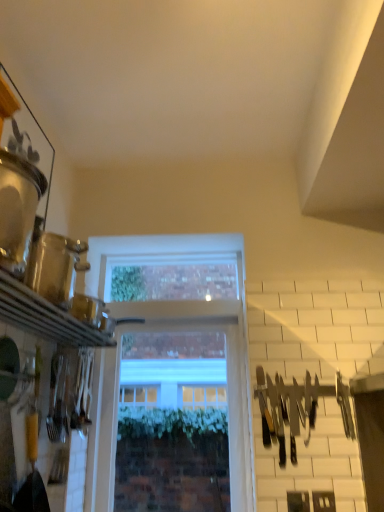
You are a GUI agent. You are given a task and a screenshot of the screen. Output one action in this format:
    pyautogui.click(x=<x>, y=<y>)
    Task: Click on the black plastic knives at right
    The width and height of the screenshot is (384, 512).
    Given the screenshot: What is the action you would take?
    pyautogui.click(x=296, y=408)

This screenshot has height=512, width=384. Describe the element at coordinates (296, 408) in the screenshot. I see `black plastic knives at right` at that location.

Where is `clear glass window at center`? clear glass window at center is located at coordinates (172, 424).

The height and width of the screenshot is (512, 384). What do you see at coordinates (172, 424) in the screenshot?
I see `clear glass window at center` at bounding box center [172, 424].

Where is `black plastic knives at right`? The height and width of the screenshot is (512, 384). black plastic knives at right is located at coordinates (296, 408).

Can you confirm if clear glass window at center is positioned to the right of black plastic knives at right?

No.

Which object is further away from the camera taking this photo, clear glass window at center or black plastic knives at right?

clear glass window at center is further away from the camera.

Does point (127, 367) lie behind point (303, 425)?

Yes.

From the image's perspective, is clear glass window at center beneath black plastic knives at right?

Yes, from the image's perspective, clear glass window at center is beneath black plastic knives at right.

From a real-world perspective, who is located higher, clear glass window at center or black plastic knives at right?

In real-world perspective, clear glass window at center is above.

Considering the sizes of objects clear glass window at center and black plastic knives at right in the image provided, who is wider, clear glass window at center or black plastic knives at right?

With larger width is clear glass window at center.

Between clear glass window at center and black plastic knives at right, which one has more height?

With more height is clear glass window at center.

Who is smaller, clear glass window at center or black plastic knives at right?

black plastic knives at right.

Is black plastic knives at right inside clear glass window at center?

No, black plastic knives at right is not inside clear glass window at center.

Can you see clear glass window at center touching black plastic knives at right?

No, clear glass window at center is not beside black plastic knives at right.

Is clear glass window at center looking in the opposite direction of black plastic knives at right?

clear glass window at center is not turned away from black plastic knives at right.

What's the angular difference between clear glass window at center and black plastic knives at right's facing directions?

1.38 degrees separate the facing orientations of clear glass window at center and black plastic knives at right.

Image resolution: width=384 pixels, height=512 pixels. Find the location of `tool on the right side of clear glass window at center`. tool on the right side of clear glass window at center is located at coordinates (296, 408).

Considering the relative positions of black plastic knives at right and clear glass window at center in the image provided, is black plastic knives at right to the left of clear glass window at center from the viewer's perspective?

No.

Based on the photo, is black plastic knives at right in front of clear glass window at center?

Yes, the depth of black plastic knives at right is less than that of clear glass window at center.

Is point (273, 432) behind point (133, 354)?

No, (273, 432) is in front of (133, 354).

Based on the photo, from the image's perspective, is black plastic knives at right above or below clear glass window at center?

Clearly, from the image's perspective, black plastic knives at right is above clear glass window at center.

Based on the photo, from a real-world perspective, is black plastic knives at right positioned over clear glass window at center based on gravity?

Result: No, from a real-world perspective, black plastic knives at right is not over clear glass window at center

Which object is thinner, black plastic knives at right or clear glass window at center?

black plastic knives at right is thinner.

Who is shorter, black plastic knives at right or clear glass window at center?

With less height is black plastic knives at right.

Does black plastic knives at right have a larger size compared to clear glass window at center?

Incorrect, black plastic knives at right is not larger than clear glass window at center.

Is black plastic knives at right situated inside clear glass window at center or outside?

black plastic knives at right is located beyond the bounds of clear glass window at center.

Are black plastic knives at right and clear glass window at center located far from each other?

No, black plastic knives at right is not far from clear glass window at center.

Is clear glass window at center at the back of black plastic knives at right?

No.

Can you tell me how much black plastic knives at right and clear glass window at center differ in facing direction?

1.38 degrees separate the facing orientations of black plastic knives at right and clear glass window at center.

At what (x,y) coordinates should I click in order to perform the action: click on window that appears on the left of black plastic knives at right. Please return your answer as a coordinate pair (x, y). The height and width of the screenshot is (512, 384). Looking at the image, I should click on (172, 424).

This screenshot has height=512, width=384. Identify the location of tool above the clear glass window at center (from the image's perspective). click(x=296, y=408).

Identify the location of tool that is in front of the clear glass window at center. (296, 408).